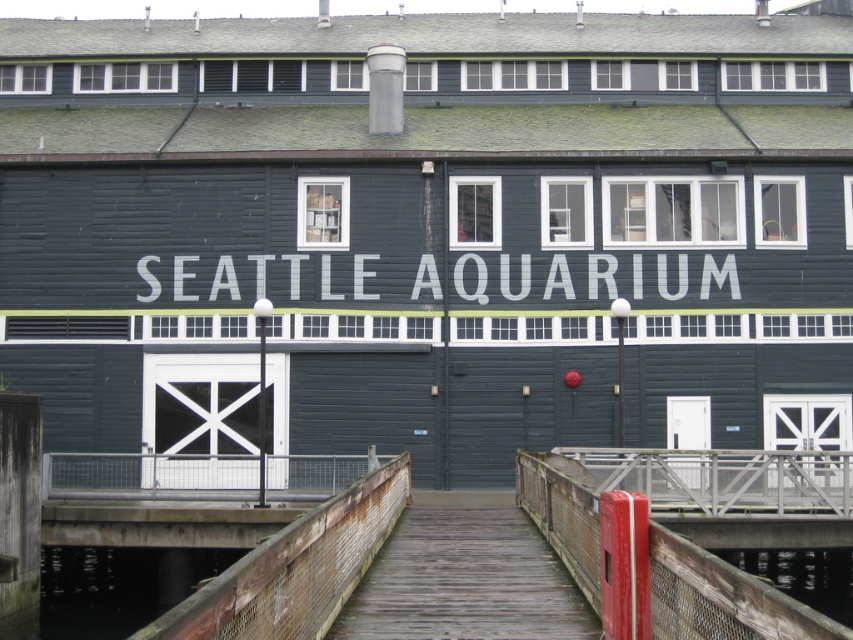
You are standing on the wooden walkway leading to the Seattle Aquarium. You notice a white painted wood sign at center and a transparent glass water at lower right. Which object is positioned higher relative to the other?

The white painted wood sign at center is located above the transparent glass water at lower right, so it is positioned higher.

You are standing on the wooden walkway in front of the Seattle Aquarium. You see a point marked at coordinates (593, 276). What object is located at that point?

The point at coordinates (593, 276) corresponds to the white painted wood sign at center.

You are standing at the entrance of the Seattle Aquarium and want to find the white painted wood sign at center. According to the image, where should you look relative to the building?

The white painted wood sign at center is located at point 0.433 along the x axis and 0.696 along the y axis relative to the building.